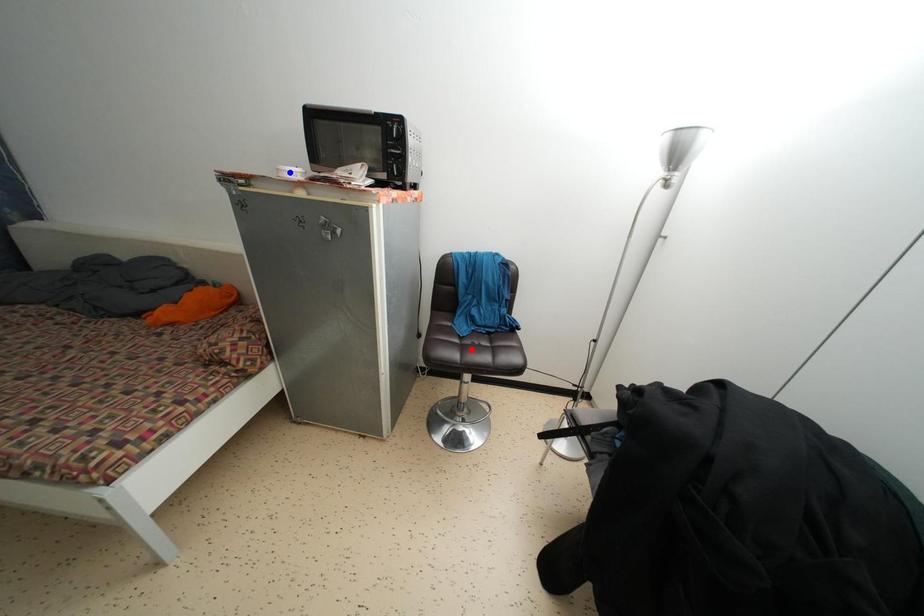
Question: In the image, two points are highlighted. Which point is nearer to the camera? Reply with the corresponding letter.

Choices:
 (A) blue point
 (B) red point

Answer: (A)